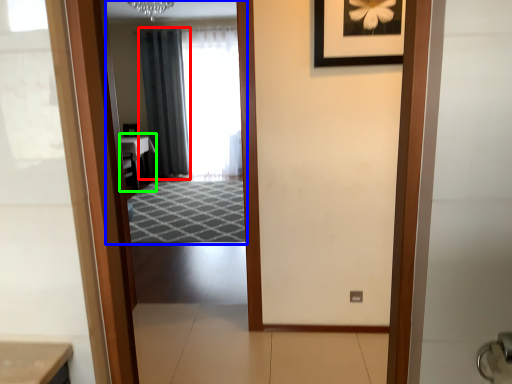
Question: Estimate the real-world distances between objects in this image. Which object is farther from curtain (highlighted by a red box), mirror (highlighted by a blue box) or table (highlighted by a green box)?

Choices:
 (A) mirror
 (B) table

Answer: (B)